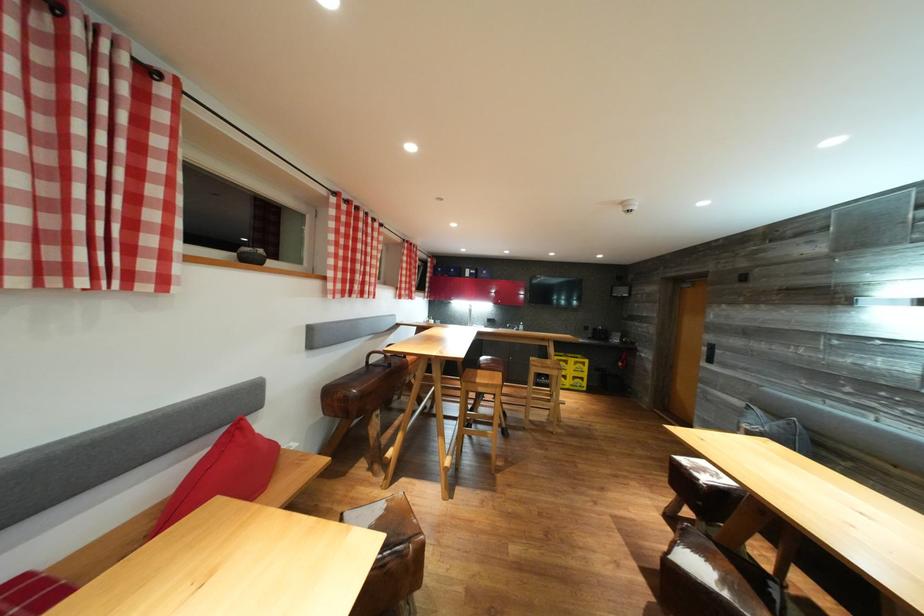
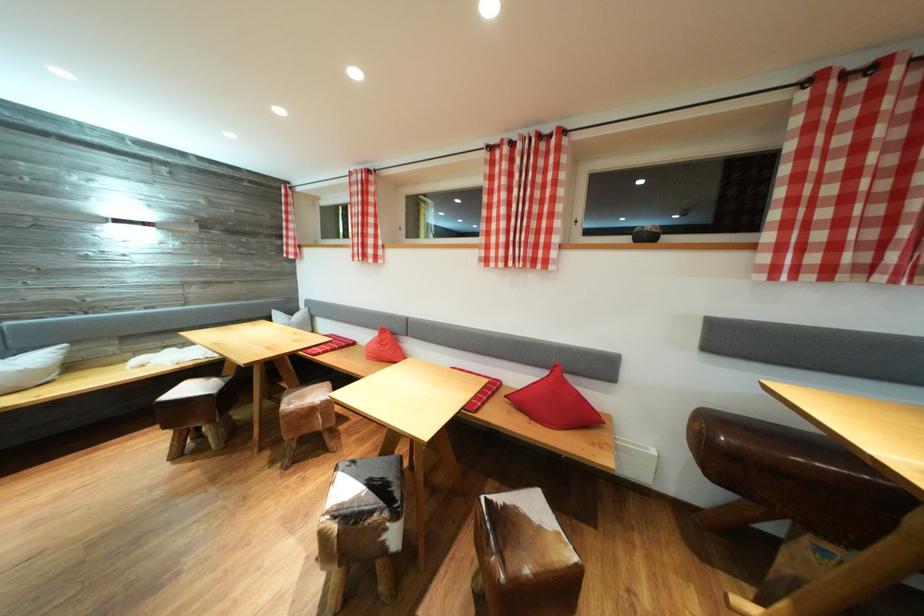
The point at (351, 201) is marked in the first image. Where is the corresponding point in the second image?

(869, 66)